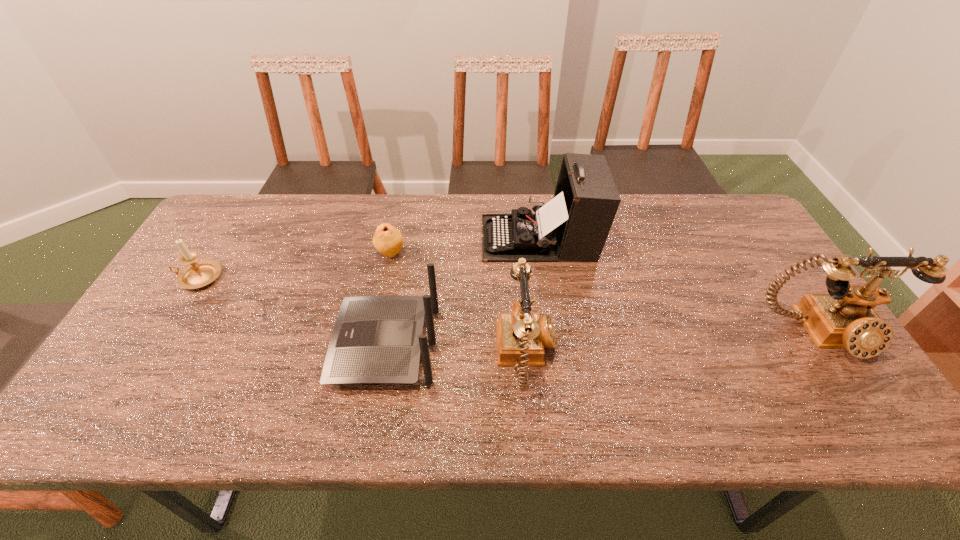
Where is `object at the near right corner`? This screenshot has height=540, width=960. object at the near right corner is located at coordinates (845, 318).

What are the coordinates of `vacant space at the far edge of the desktop` in the screenshot? It's located at (438, 195).

Where is `free spot at the near edge of the desktop`? free spot at the near edge of the desktop is located at coordinates (282, 364).

This screenshot has width=960, height=540. What are the coordinates of `vacant region at the left edge` in the screenshot? It's located at (187, 312).

Locate an element on the screen. The height and width of the screenshot is (540, 960). free point at the right edge is located at coordinates (805, 347).

This screenshot has height=540, width=960. In the image, there is a desktop. Identify the location of vacant space at the far left corner. (227, 220).

In the image, there is a desktop. Where is `vacant space at the near left corner`? vacant space at the near left corner is located at coordinates (111, 370).

At what (x,y) coordinates should I click in order to perform the action: click on vacant space that is in between the typewriter and the right telephone. Please return your answer as a coordinate pair (x, y). Looking at the image, I should click on tap(681, 286).

Where is `vacant space in between the shorter telephone and the shortest object`? vacant space in between the shorter telephone and the shortest object is located at coordinates (459, 305).

You are a GUI agent. You are given a task and a screenshot of the screen. Output one action in this format:
    pyautogui.click(x=<x>, y=<y>)
    Task: Click on the free space between the router and the typewriter
    
    Given the screenshot: What is the action you would take?
    pyautogui.click(x=463, y=291)